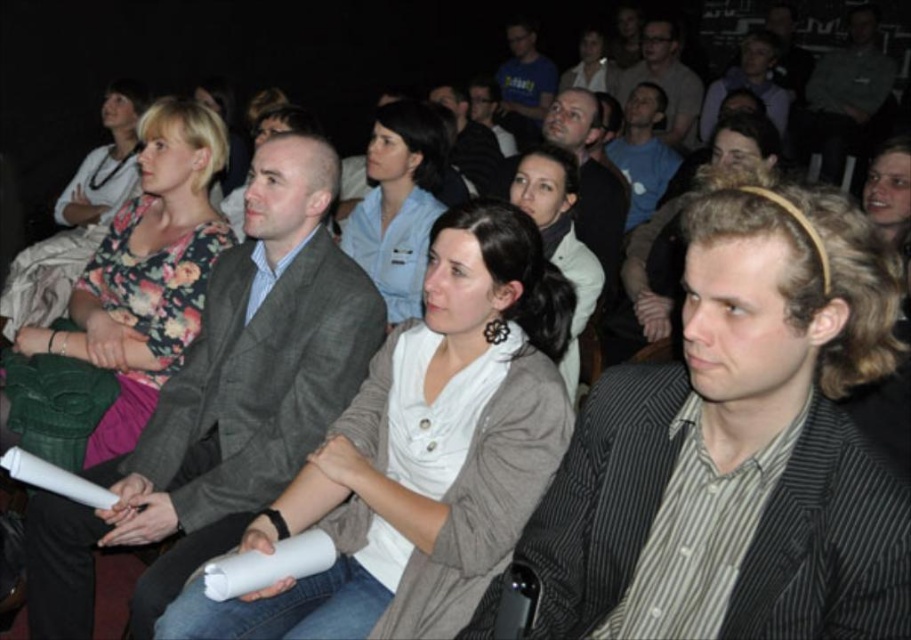
This screenshot has width=911, height=640. I want to click on white matte shirt at center, so click(x=423, y=452).

Is point (471, 518) behind point (689, 141)?

No, it is not.

Where is `white matte shirt at center`? white matte shirt at center is located at coordinates (423, 452).

Image resolution: width=911 pixels, height=640 pixels. I want to click on white matte shirt at center, so [x=423, y=452].

Is gray woolen suit at center smaller than floral print blouse at upper left?

No.

Who is more forward, (222, 294) or (132, 305)?

Point (222, 294) is in front.

The image size is (911, 640). I want to click on gray woolen suit at center, so click(x=224, y=401).

Does white shirt at center appear on the left side of matte gray suit at upper center?

Correct, you'll find white shirt at center to the left of matte gray suit at upper center.

Who is more distant from viewer, (555,166) or (678,84)?

Point (678,84)

Locate an element on the screen. The height and width of the screenshot is (640, 911). white shirt at center is located at coordinates (559, 237).